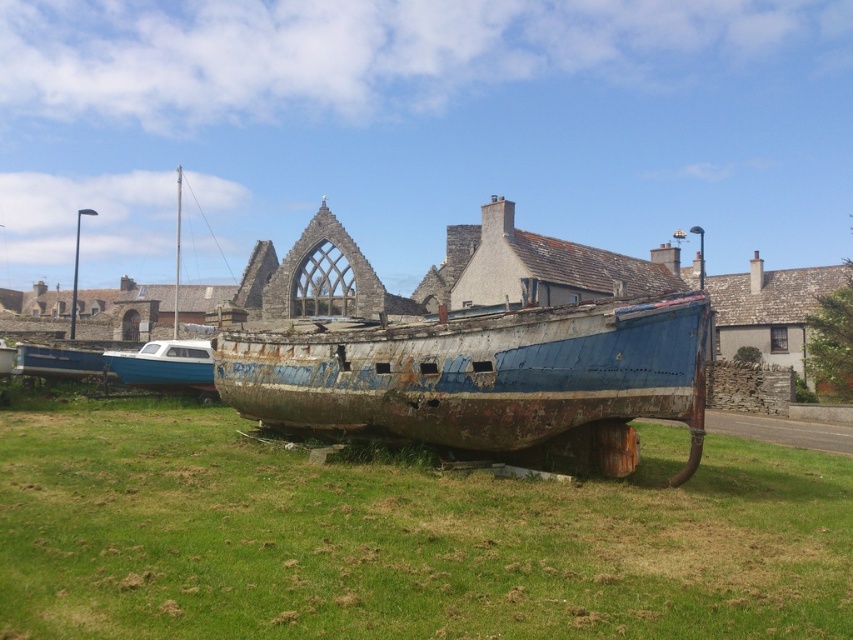
You are a photographer trying to capture both the rusty metal boat at center and the rusty metal boat at lower left in a single frame. Which boat should you focus on to ensure the taller one is clearly visible in your photo?

The rusty metal boat at center is much taller than the rusty metal boat at lower left, so focusing on it will ensure the taller boat is clearly visible in your photo.

You are standing at the point marked as point (399, 536) in the image. Looking around, you see the green grassy at center. What is the name of the object you are standing on?

The green grassy at center is located at point (399, 536), so you are standing on the green grassy at center.

You are a photographer planning to take a picture of the rusty metal boat at center and the rusty metal boat at lower left. Which boat should you focus on first if you want to capture both in a single frame without moving the camera?

You should focus on the rusty metal boat at center first because it is positioned under the rusty metal boat at lower left, meaning it is closer to the camera. By focusing on the closer boat first, you can ensure both are in the frame without needing to adjust the camera position.